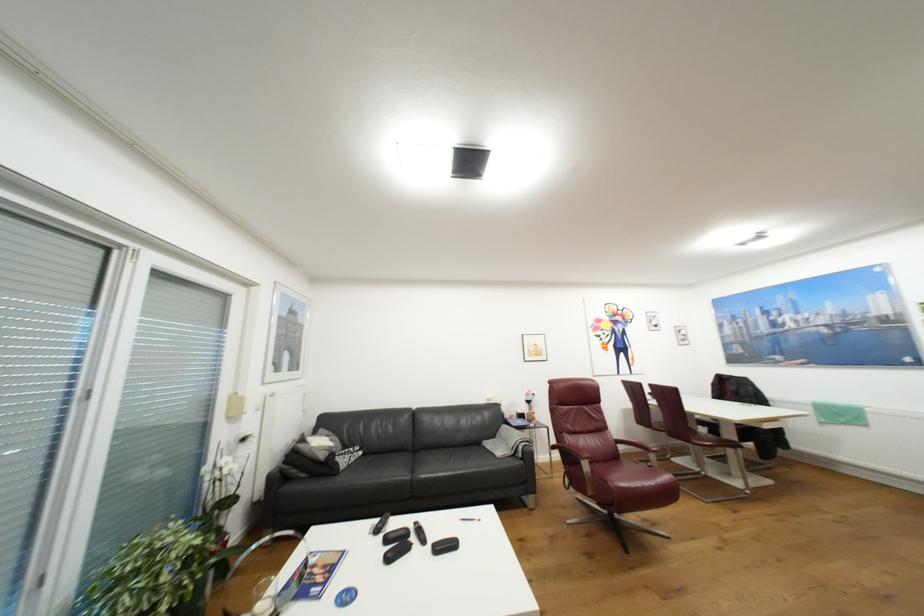
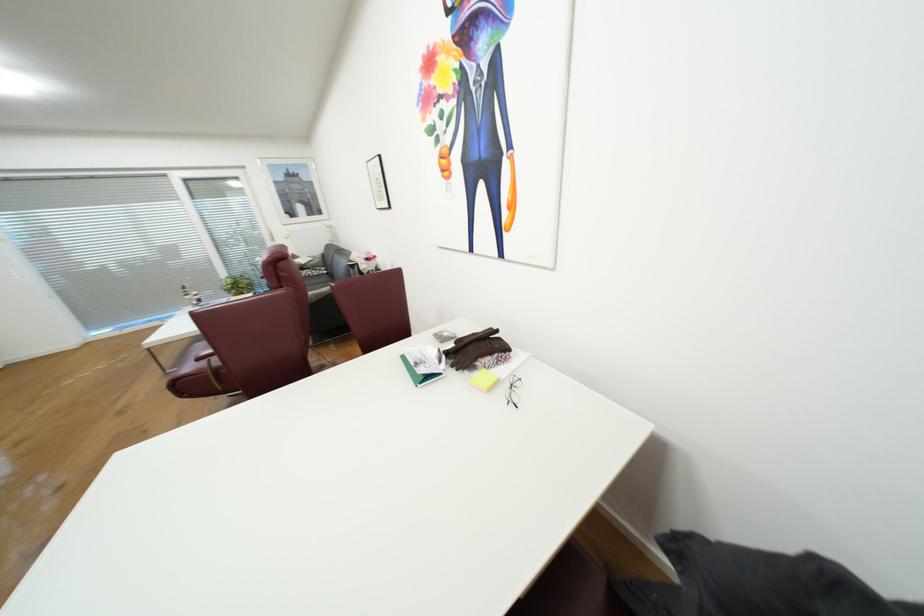
Question: I am providing you with two images of the same scene from different viewpoints. Please identify which objects are invisible in image2.

Choices:
 (A) sofa armrest
 (B) cabinet door handle
 (C) pair of eyeglasses
 (D) red chair sitting surface

Answer: (D)